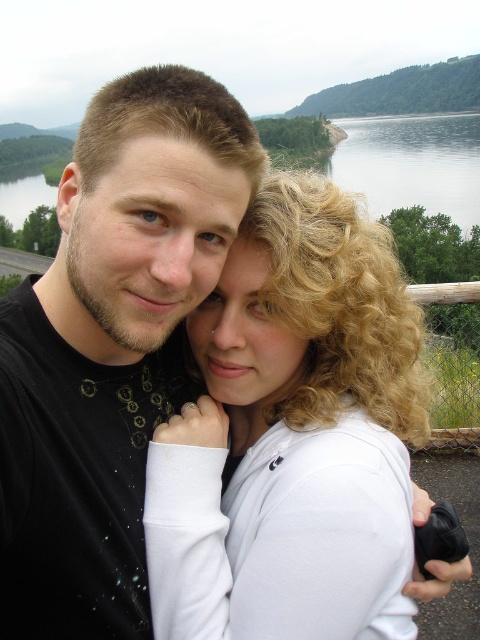
Which is more to the left, black matte shirt at center or transparent water at upper center?

black matte shirt at center is more to the left.

Can you confirm if black matte shirt at center is taller than transparent water at upper center?

No, black matte shirt at center is not taller than transparent water at upper center.

Which is behind, point (144, 145) or point (388, 145)?

Point (388, 145)

Identify the location of black matte shirt at center. The image size is (480, 640). (109, 346).

How much distance is there between white matte hair at center and transparent water at upper center?

white matte hair at center is 429.03 meters from transparent water at upper center.

Is white matte hair at center shorter than transparent water at upper center?

Yes, white matte hair at center is shorter than transparent water at upper center.

Does point (308, 492) come in front of point (348, 182)?

Yes, it is in front of point (348, 182).

This screenshot has width=480, height=640. Find the location of `white matte hair at center`. white matte hair at center is located at coordinates (292, 435).

Is point (268, 625) farther from camera compared to point (60, 602)?

Yes, it is behind point (60, 602).

Who is more distant from viewer, [312,228] or [7,508]?

The point [312,228] is behind.

Identify the location of white matte hair at center. (292, 435).